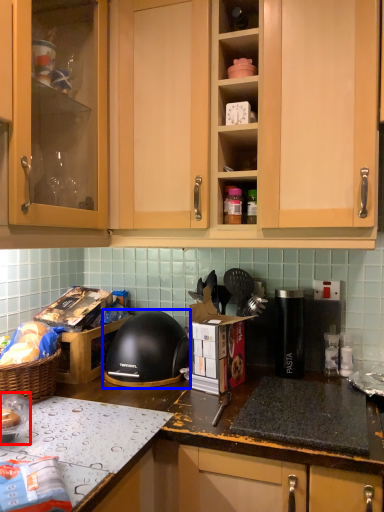
Question: Which point is further to the camera, appliance (highlighted by a red box) or helmet (highlighted by a blue box)?

Choices:
 (A) appliance
 (B) helmet

Answer: (B)